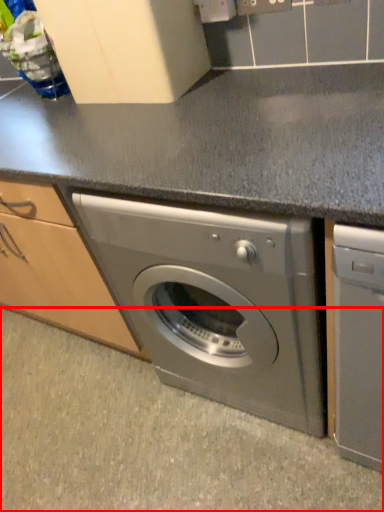
Question: Considering the relative positions of granite (annotated by the red box) and washing machine in the image provided, where is granite (annotated by the red box) located with respect to the staircase?

Choices:
 (A) left
 (B) right

Answer: (A)